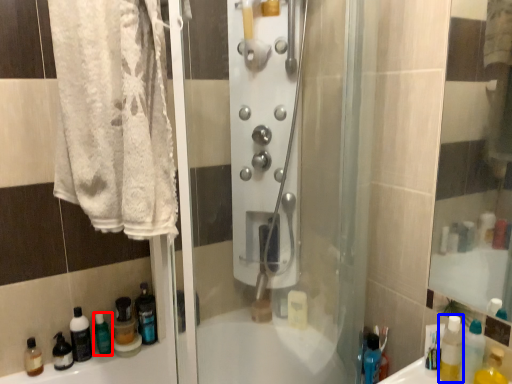
Question: Which of the following is the closest to the observer, cleaning product (highlighted by a red box) or mouthwash (highlighted by a blue box)?

Choices:
 (A) cleaning product
 (B) mouthwash

Answer: (B)